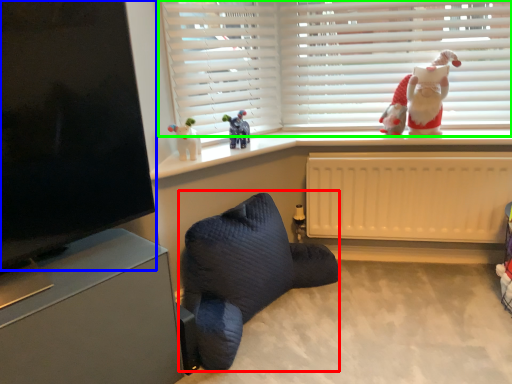
Question: Based on their relative distances, which object is nearer to bean bag chair (highlighted by a red box)? Choose from window screen (highlighted by a blue box) and window blind (highlighted by a green box).

Choices:
 (A) window screen
 (B) window blind

Answer: (A)